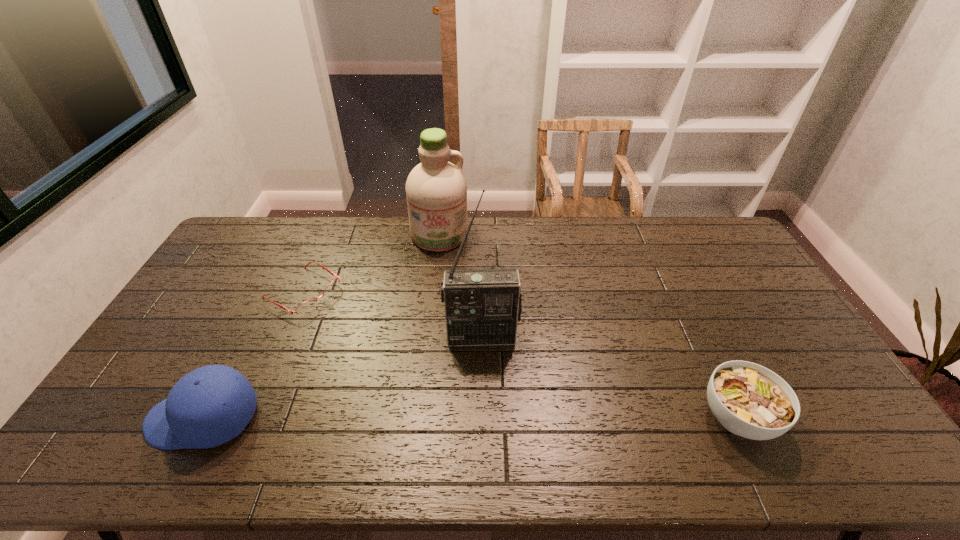
In the image, there is a desktop. At what (x,y) coordinates should I click in order to perform the action: click on free space at the near right corner. Please return your answer as a coordinate pair (x, y). The image size is (960, 540). Looking at the image, I should click on pyautogui.click(x=833, y=404).

The width and height of the screenshot is (960, 540). I want to click on vacant space in between the spectacles and the radio receiver, so click(x=393, y=314).

Find the location of a particular element. free area in between the third farthest object and the rightmost object is located at coordinates (610, 377).

This screenshot has height=540, width=960. Find the location of `vacant space that's between the radio receiver and the second shortest object`. vacant space that's between the radio receiver and the second shortest object is located at coordinates (610, 377).

This screenshot has height=540, width=960. Identify the location of free space between the cap and the third farthest object. (343, 377).

The width and height of the screenshot is (960, 540). Identify the location of unoccupied position between the spectacles and the fourth shortest object. (371, 264).

At what (x,y) coordinates should I click in order to perform the action: click on vacant area between the soup bowl and the cap. Please return your answer as a coordinate pair (x, y). Looking at the image, I should click on (470, 418).

The height and width of the screenshot is (540, 960). I want to click on free point between the second shortest object and the shortest object, so click(520, 355).

At what (x,y) coordinates should I click in order to perform the action: click on empty space between the cap and the rightmost object. Please return your answer as a coordinate pair (x, y). The image size is (960, 540). Looking at the image, I should click on (470, 418).

This screenshot has height=540, width=960. I want to click on vacant point located between the spectacles and the soup bowl, so click(x=520, y=355).